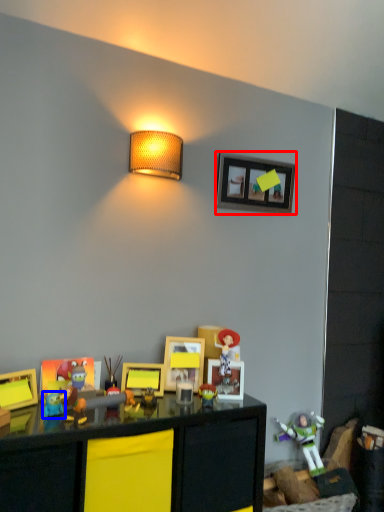
Question: Which object is closer to the camera taking this photo, picture frame (highlighted by a red box) or toy (highlighted by a blue box)?

Choices:
 (A) picture frame
 (B) toy

Answer: (B)